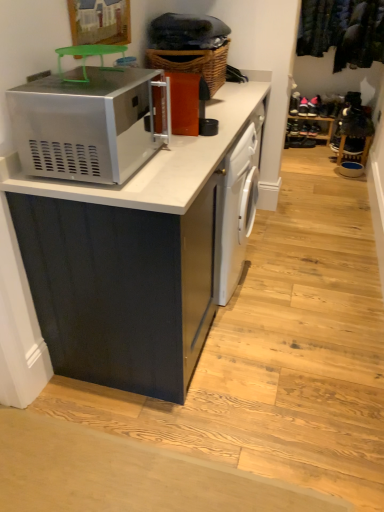
Locate an element on the screen. vacant area located to the right-hand side of white glossy dishwasher at center is located at coordinates (290, 290).